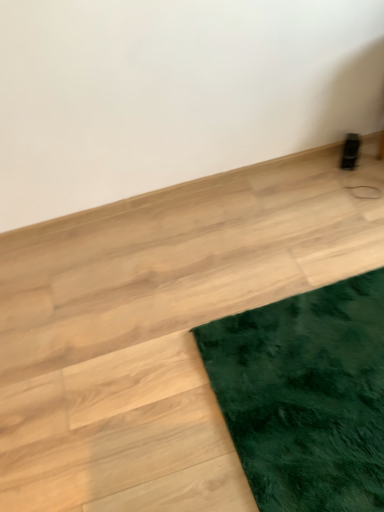
The height and width of the screenshot is (512, 384). Find the location of `blank space above wooden floor at lower right (from a real-world perspective)`. blank space above wooden floor at lower right (from a real-world perspective) is located at coordinates (219, 343).